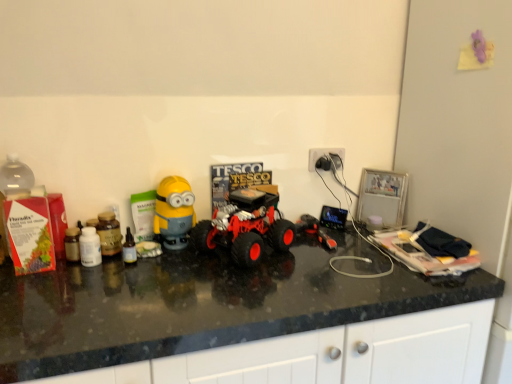
Question: Visually, is rubberized red monster truck at center, which is counted as the second toy, starting from the left, positioned to the left or to the right of white plastic plug at upper right?

Choices:
 (A) left
 (B) right

Answer: (A)

Question: From a real-world perspective, relative to white plastic plug at upper right, is rubberized red monster truck at center, which is counted as the second toy, starting from the left, vertically above or below?

Choices:
 (A) above
 (B) below

Answer: (B)

Question: Based on their relative distances, which object is nearer to the black glossy countertop at center?

Choices:
 (A) rubberized red monster truck at center, the 2th toy viewed from the right
 (B) translucent glass bottle at center
 (C) yellow matte minion toy at center-left, arranged as the third toy when viewed from the right
 (D) rubberized black toy truck at center, placed as the first toy when sorted from right to left
 (E) white plastic plug at upper right

Answer: (A)

Question: Based on their relative distances, which object is farther from the translucent glass bottle at center?

Choices:
 (A) yellow matte minion toy at center-left, which ranks as the 1th toy in left-to-right order
 (B) rubberized black toy truck at center, arranged as the 3th toy when viewed from the left
 (C) rubberized red monster truck at center, which is counted as the second toy, starting from the left
 (D) white plastic plug at upper right
 (E) black glossy countertop at center

Answer: (D)